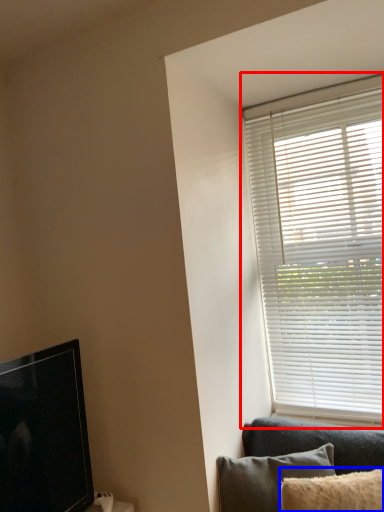
Question: Which of the following is the closest to the observer, window blind (highlighted by a red box) or pillow (highlighted by a blue box)?

Choices:
 (A) window blind
 (B) pillow

Answer: (B)